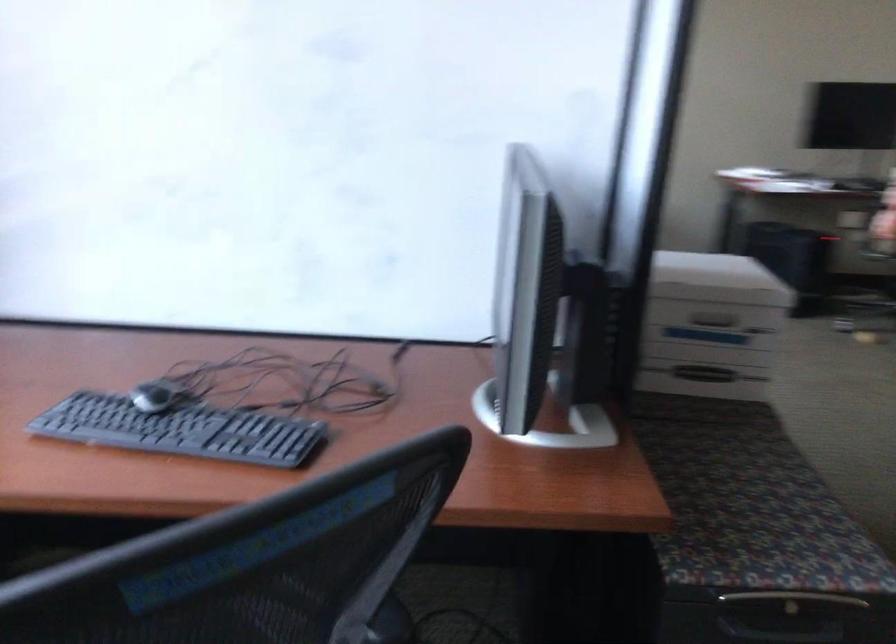
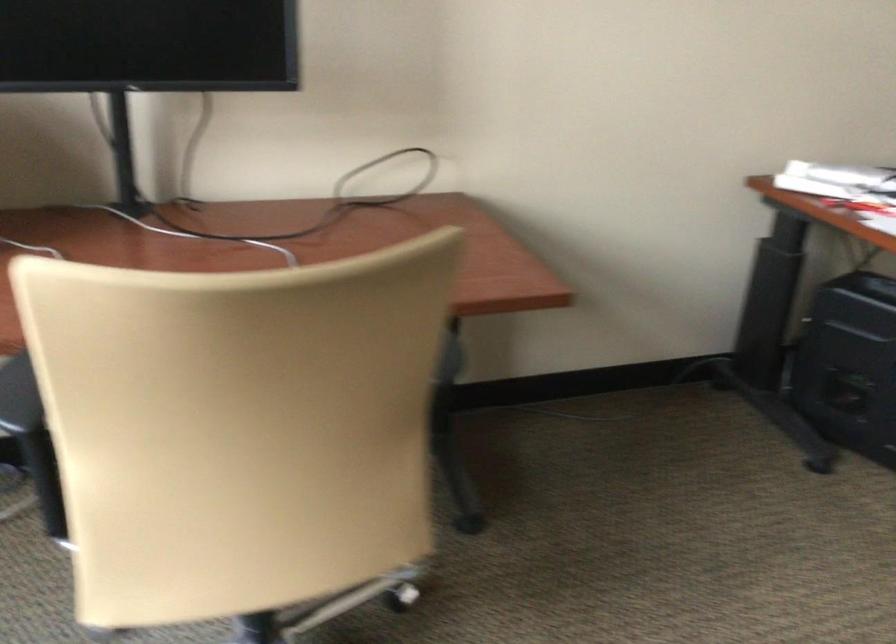
Question: Which direction would the cameraman need to move to produce the second image? Reply with the corresponding letter.

Choices:
 (A) Left
 (B) Right
 (C) Forward
 (D) Backward

Answer: (C)